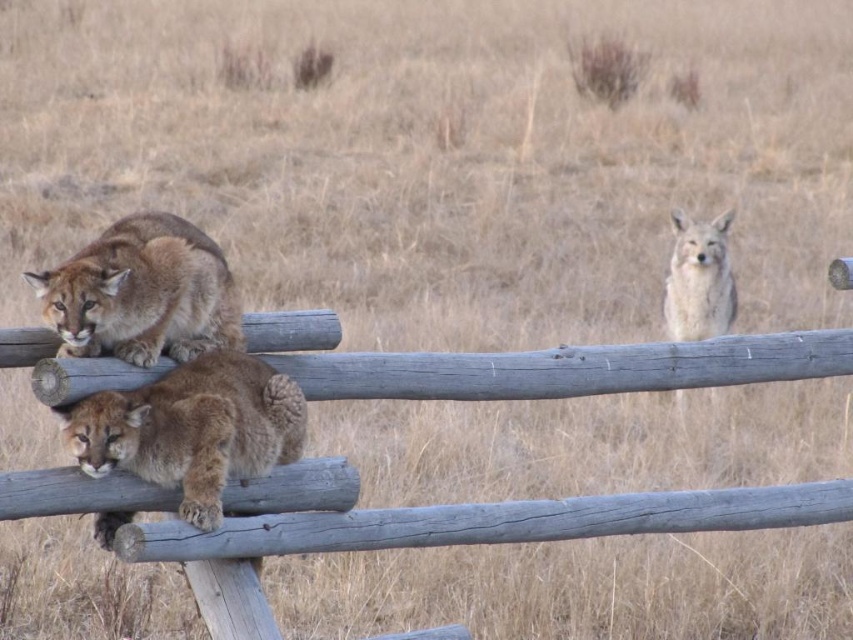
Is brown fur cougar at left thinner than fuzzy beige fox at upper right?

Yes, brown fur cougar at left is thinner than fuzzy beige fox at upper right.

Measure the distance from brown fur cougar at left to fuzzy beige fox at upper right.

The distance of brown fur cougar at left from fuzzy beige fox at upper right is 19.96 feet.

The image size is (853, 640). Describe the element at coordinates (142, 292) in the screenshot. I see `brown fur cougar at left` at that location.

This screenshot has height=640, width=853. What are the coordinates of `brown fur cougar at left` in the screenshot? It's located at (142, 292).

Does brown furry cougar at center appear on the left side of brown fur cougar at left?

In fact, brown furry cougar at center is to the right of brown fur cougar at left.

Can you confirm if brown furry cougar at center is bigger than brown fur cougar at left?

Correct, brown furry cougar at center is larger in size than brown fur cougar at left.

The height and width of the screenshot is (640, 853). What do you see at coordinates (192, 428) in the screenshot? I see `brown furry cougar at center` at bounding box center [192, 428].

Where is `brown furry cougar at center`? brown furry cougar at center is located at coordinates (192, 428).

Can you confirm if brown furry cougar at center is wider than fuzzy beige fox at upper right?

Correct, the width of brown furry cougar at center exceeds that of fuzzy beige fox at upper right.

This screenshot has height=640, width=853. What do you see at coordinates (192, 428) in the screenshot?
I see `brown furry cougar at center` at bounding box center [192, 428].

Image resolution: width=853 pixels, height=640 pixels. What are the coordinates of `brown furry cougar at center` in the screenshot? It's located at pos(192,428).